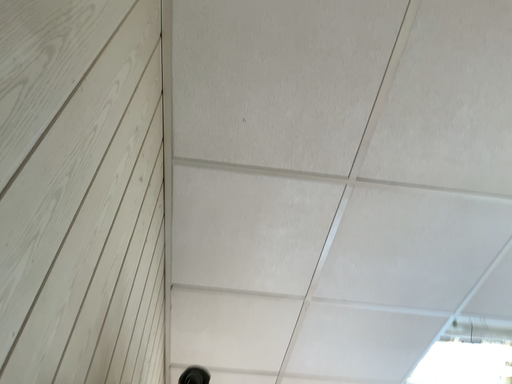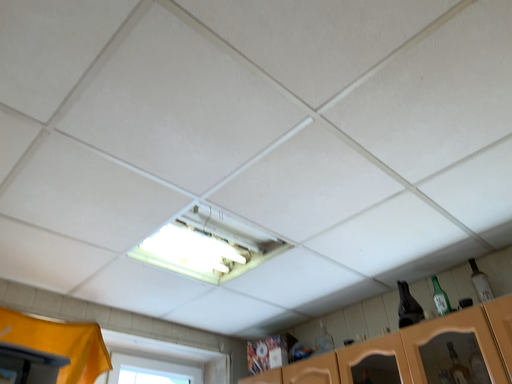
Question: Which way did the camera rotate in the video?

Choices:
 (A) rotated downward
 (B) rotated upward

Answer: (A)